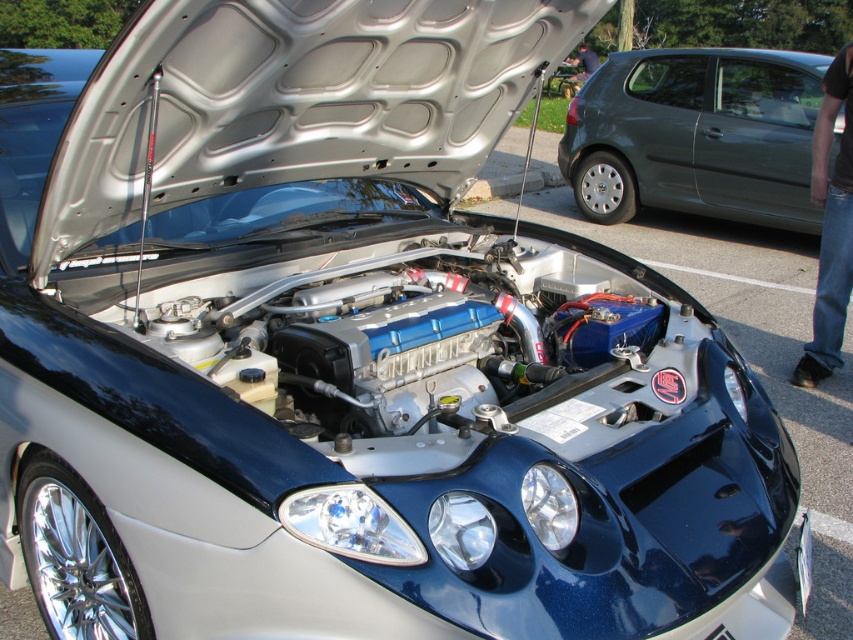
Question: Which point is closer to the camera?

Choices:
 (A) jeans at right
 (B) metallic gray hatchback at right

Answer: (A)

Question: Can you confirm if metallic gray hatchback at right is positioned above jeans at right?

Choices:
 (A) no
 (B) yes

Answer: (B)

Question: Which of the following is the closest to the observer?

Choices:
 (A) (717, 65)
 (B) (811, 186)

Answer: (B)

Question: In this image, where is metallic gray hatchback at right located relative to jeans at right?

Choices:
 (A) right
 (B) left

Answer: (A)

Question: Is metallic gray hatchback at right thinner than jeans at right?

Choices:
 (A) yes
 (B) no

Answer: (B)